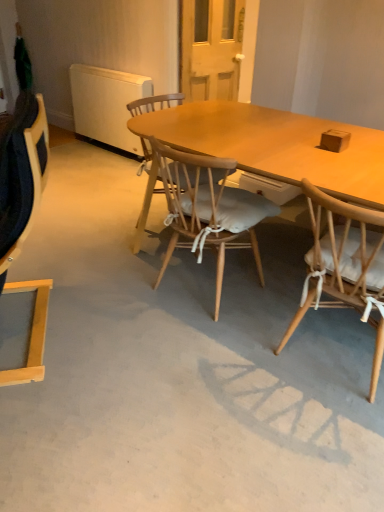
The image size is (384, 512). I want to click on vacant area that lies in front of wooden chair with white cushion at right, the 3th chair from the left, so click(316, 445).